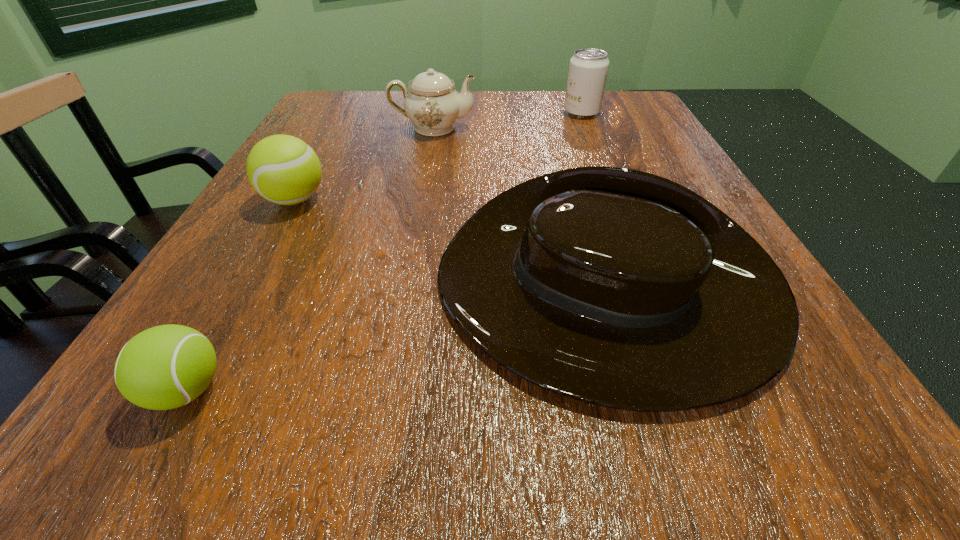
Where is `free location that satisfies the following two spatial constraints: 1. on the back side of the cowboy hat; 2. on the right side of the soda can`? free location that satisfies the following two spatial constraints: 1. on the back side of the cowboy hat; 2. on the right side of the soda can is located at coordinates (552, 112).

You are a GUI agent. You are given a task and a screenshot of the screen. Output one action in this format:
    pyautogui.click(x=<x>, y=<y>)
    Task: Click on the free spot that satisfies the following two spatial constraints: 1. at the spout of the chinaware; 2. on the front side of the taller tennis ball
    The height and width of the screenshot is (540, 960).
    Given the screenshot: What is the action you would take?
    pyautogui.click(x=420, y=200)